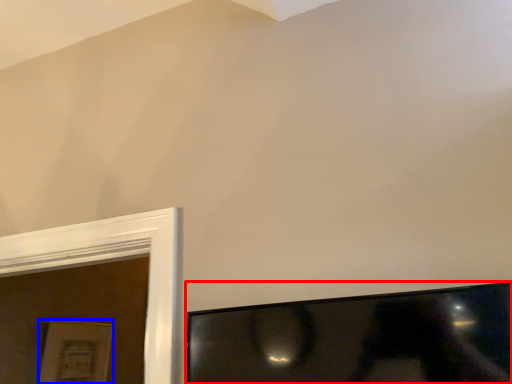
Question: Which of the following is the closest to the observer, television (highlighted by a red box) or picture frame (highlighted by a blue box)?

Choices:
 (A) television
 (B) picture frame

Answer: (A)